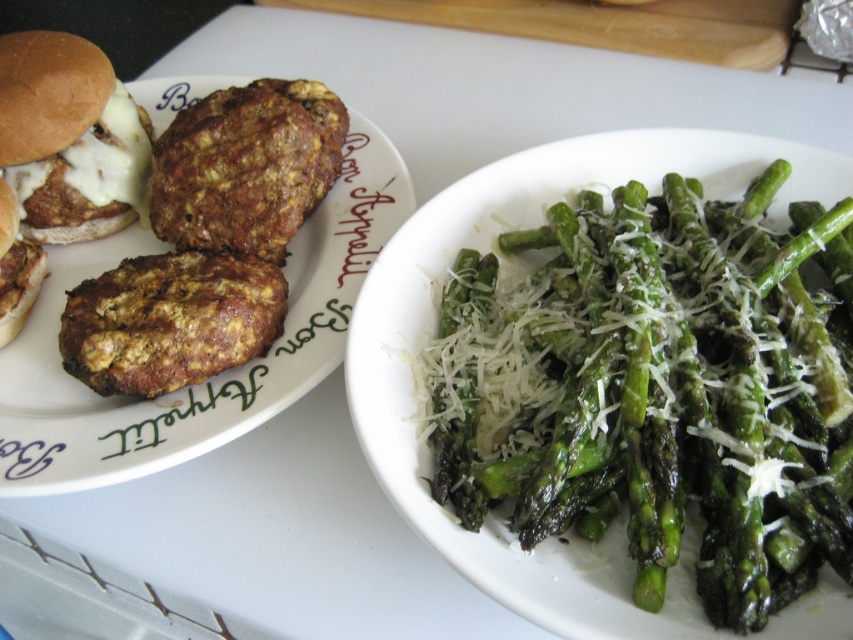
Question: Which object is positioned farthest from the white melted cheese on meat patty at upper left?

Choices:
 (A) brown crumbly meat at center
 (B) matte brown patty at left
 (C) brown crumbly meat at upper left
 (D) green asparagus at right

Answer: (D)

Question: Can you confirm if green asparagus at right is positioned to the right of brown crumbly meatballs at left?

Choices:
 (A) no
 (B) yes

Answer: (B)

Question: Does white melted cheese on meat patty at upper left come behind matte brown patty at left?

Choices:
 (A) no
 (B) yes

Answer: (B)

Question: Which point is farther to the camera?

Choices:
 (A) brown crumbly meat at center
 (B) brown crumbly meat at upper left
 (C) brown crumbly meatballs at left
 (D) green asparagus at right

Answer: (B)

Question: Based on their relative distances, which object is farther from the brown crumbly meatballs at left?

Choices:
 (A) brown crumbly meat at center
 (B) matte brown patty at left
 (C) brown crumbly meat at upper left
 (D) green asparagus at right

Answer: (D)

Question: Can you confirm if white melted cheese on meat patty at upper left is positioned above brown crumbly meat at center?

Choices:
 (A) yes
 (B) no

Answer: (A)